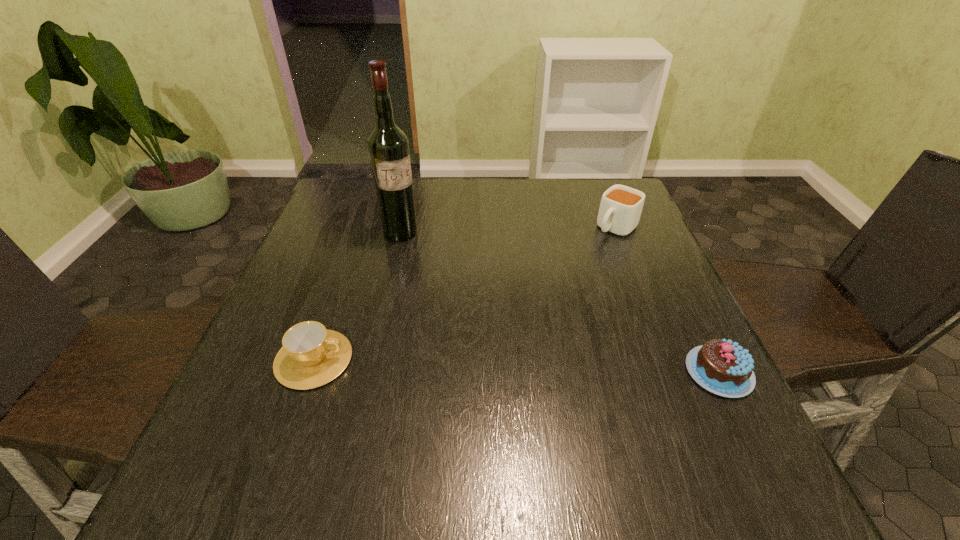
Locate an element on the screen. The width and height of the screenshot is (960, 540). vacant space that satisfies the following two spatial constraints: 1. on the front side of the second tallest object; 2. on the left side of the chocolate cake is located at coordinates (675, 372).